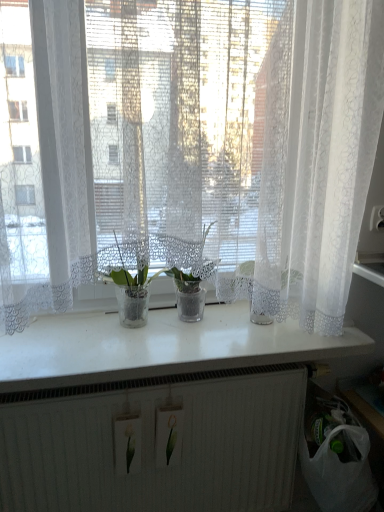
Where is `vacant area that lies in front of translucent glass pot at center, the first houseplant from the right`? The image size is (384, 512). vacant area that lies in front of translucent glass pot at center, the first houseplant from the right is located at coordinates (195, 343).